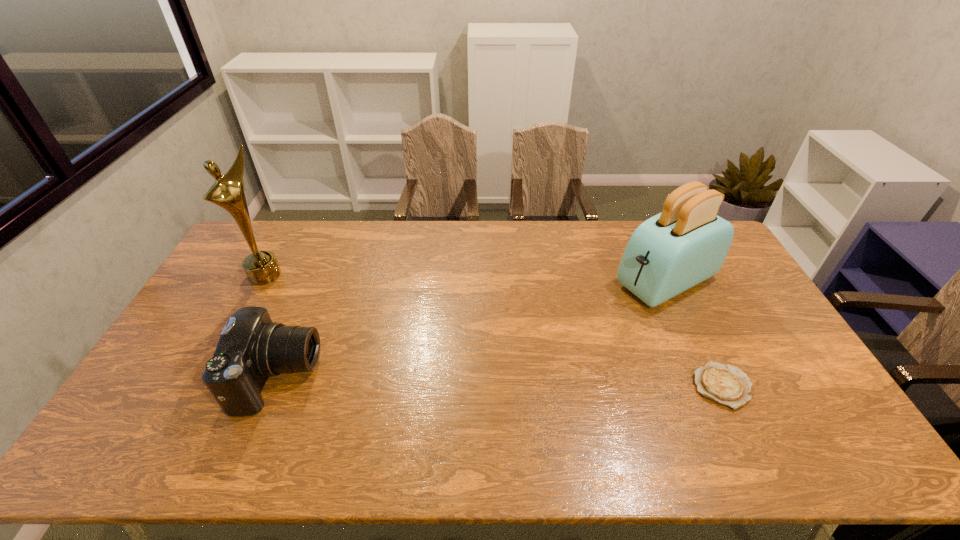
Locate an element on the screen. vacant area at the far edge of the desktop is located at coordinates (568, 251).

Locate an element on the screen. This screenshot has width=960, height=540. blank area at the near edge is located at coordinates (622, 407).

Where is `free point at the right edge`? The width and height of the screenshot is (960, 540). free point at the right edge is located at coordinates (739, 346).

The height and width of the screenshot is (540, 960). I want to click on blank space at the far left corner of the desktop, so click(269, 237).

Where is `free space between the leftmost object and the quiche`? The height and width of the screenshot is (540, 960). free space between the leftmost object and the quiche is located at coordinates (493, 330).

Where is `empty space between the third tallest object and the second tallest object`? This screenshot has width=960, height=540. empty space between the third tallest object and the second tallest object is located at coordinates (472, 329).

I want to click on free space between the leftmost object and the shortest object, so click(x=493, y=330).

Identify the location of unoccupied position between the third shortest object and the tallest object. This screenshot has height=540, width=960. (466, 278).

The height and width of the screenshot is (540, 960). In order to click on vacant area that lies between the shortest object and the second shortest object in this screenshot , I will do `click(500, 382)`.

You are a GUI agent. You are given a task and a screenshot of the screen. Output one action in this format:
    pyautogui.click(x=<x>, y=<y>)
    Task: Click on the vacant space that is in between the shortest object and the award
    
    Given the screenshot: What is the action you would take?
    pyautogui.click(x=493, y=330)